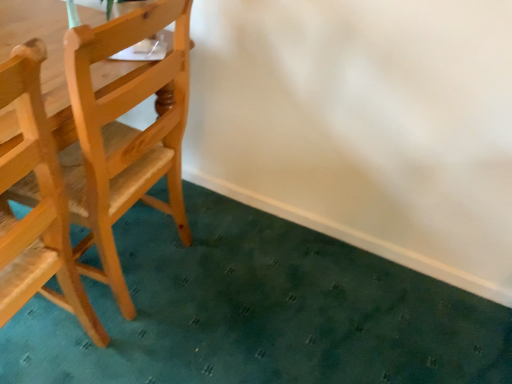
The image size is (512, 384). What do you see at coordinates (37, 204) in the screenshot?
I see `light brown wood chair at left, arranged as the second chair when viewed from the right` at bounding box center [37, 204].

Locate an element on the screen. This screenshot has width=512, height=384. light brown wood chair at left, acting as the 1th chair starting from the left is located at coordinates (37, 204).

Image resolution: width=512 pixels, height=384 pixels. What do you see at coordinates (125, 133) in the screenshot?
I see `natural wood chair at left, acting as the first chair starting from the right` at bounding box center [125, 133].

You are a GUI agent. You are given a task and a screenshot of the screen. Output one action in this format:
    pyautogui.click(x=<x>, y=<y>)
    Task: Click on the natural wood chair at left, acting as the first chair starting from the right
    The height and width of the screenshot is (384, 512).
    Given the screenshot: What is the action you would take?
    pyautogui.click(x=125, y=133)

Locate an element on the screen. The height and width of the screenshot is (384, 512). light brown wood chair at left, arranged as the second chair when viewed from the right is located at coordinates (37, 204).

Between light brown wood chair at left, acting as the 1th chair starting from the left, and natural wood chair at left, the 2th chair viewed from the left, which one appears on the left side from the viewer's perspective?

Positioned to the left is light brown wood chair at left, acting as the 1th chair starting from the left.

Does light brown wood chair at left, acting as the 1th chair starting from the left, come behind natural wood chair at left, acting as the first chair starting from the right?

No, it is in front of natural wood chair at left, acting as the first chair starting from the right.

Between point (21, 48) and point (160, 9), which one is positioned behind?

Positioned behind is point (160, 9).

From the image's perspective, would you say light brown wood chair at left, acting as the 1th chair starting from the left, is positioned over natural wood chair at left, the 2th chair viewed from the left?

Incorrect, from the image's perspective, light brown wood chair at left, acting as the 1th chair starting from the left, is lower than natural wood chair at left, the 2th chair viewed from the left.

From a real-world perspective, is light brown wood chair at left, acting as the 1th chair starting from the left, located higher than natural wood chair at left, the 2th chair viewed from the left?

Actually, light brown wood chair at left, acting as the 1th chair starting from the left, is physically below natural wood chair at left, the 2th chair viewed from the left, in the real world.

Does light brown wood chair at left, arranged as the second chair when viewed from the right, have a lesser width compared to natural wood chair at left, acting as the first chair starting from the right?

Correct, the width of light brown wood chair at left, arranged as the second chair when viewed from the right, is less than that of natural wood chair at left, acting as the first chair starting from the right.

Can you confirm if light brown wood chair at left, acting as the 1th chair starting from the left, is shorter than natural wood chair at left, acting as the first chair starting from the right?

No, light brown wood chair at left, acting as the 1th chair starting from the left, is not shorter than natural wood chair at left, acting as the first chair starting from the right.

Based on the photo, which of these two, light brown wood chair at left, acting as the 1th chair starting from the left, or natural wood chair at left, the 2th chair viewed from the left, is bigger?

Bigger between the two is natural wood chair at left, the 2th chair viewed from the left.

Is light brown wood chair at left, arranged as the second chair when viewed from the right, surrounding natural wood chair at left, acting as the first chair starting from the right?

No, natural wood chair at left, acting as the first chair starting from the right, is not surrounded by light brown wood chair at left, arranged as the second chair when viewed from the right.

Is light brown wood chair at left, acting as the 1th chair starting from the left, positioned far away from natural wood chair at left, acting as the first chair starting from the right?

No, there isn't a large distance between light brown wood chair at left, acting as the 1th chair starting from the left, and natural wood chair at left, acting as the first chair starting from the right.

Could you tell me if light brown wood chair at left, acting as the 1th chair starting from the left, is turned towards natural wood chair at left, the 2th chair viewed from the left?

No, light brown wood chair at left, acting as the 1th chair starting from the left, is not facing towards natural wood chair at left, the 2th chair viewed from the left.

Locate an element on the screen. chair that is above the light brown wood chair at left, acting as the 1th chair starting from the left (from the image's perspective) is located at coordinates (125, 133).

Is natural wood chair at left, the 2th chair viewed from the left, at the left side of light brown wood chair at left, acting as the 1th chair starting from the left?

No.

Is natural wood chair at left, the 2th chair viewed from the left, positioned behind light brown wood chair at left, acting as the 1th chair starting from the left?

Yes, natural wood chair at left, the 2th chair viewed from the left, is behind light brown wood chair at left, acting as the 1th chair starting from the left.

Is point (79, 203) positioned in front of point (36, 129)?

No, it is behind (36, 129).

From the image's perspective, relative to light brown wood chair at left, acting as the 1th chair starting from the left, is natural wood chair at left, acting as the first chair starting from the right, above or below?

Clearly, from the image's perspective, natural wood chair at left, acting as the first chair starting from the right, is above light brown wood chair at left, acting as the 1th chair starting from the left.

From a real-world perspective, is natural wood chair at left, the 2th chair viewed from the left, on top of light brown wood chair at left, acting as the 1th chair starting from the left?

Yes.

In terms of width, does natural wood chair at left, the 2th chair viewed from the left, look wider or thinner when compared to light brown wood chair at left, arranged as the second chair when viewed from the right?

natural wood chair at left, the 2th chair viewed from the left, is wider than light brown wood chair at left, arranged as the second chair when viewed from the right.

Between natural wood chair at left, acting as the first chair starting from the right, and light brown wood chair at left, arranged as the second chair when viewed from the right, which one has less height?

natural wood chair at left, acting as the first chair starting from the right, is shorter.

Is natural wood chair at left, acting as the first chair starting from the right, bigger than light brown wood chair at left, arranged as the second chair when viewed from the right?

Yes.

Can we say natural wood chair at left, the 2th chair viewed from the left, lies outside light brown wood chair at left, acting as the 1th chair starting from the left?

Yes, natural wood chair at left, the 2th chair viewed from the left, is not within light brown wood chair at left, acting as the 1th chair starting from the left.

Is there a large distance between natural wood chair at left, the 2th chair viewed from the left, and light brown wood chair at left, arranged as the second chair when viewed from the right?

No, natural wood chair at left, the 2th chair viewed from the left, is not far from light brown wood chair at left, arranged as the second chair when viewed from the right.

Is natural wood chair at left, acting as the first chair starting from the right, facing away from light brown wood chair at left, acting as the 1th chair starting from the left?

natural wood chair at left, acting as the first chair starting from the right, is not turned away from light brown wood chair at left, acting as the 1th chair starting from the left.

Can you tell me how much natural wood chair at left, the 2th chair viewed from the left, and light brown wood chair at left, acting as the 1th chair starting from the left, differ in facing direction?

The angle between the facing direction of natural wood chair at left, the 2th chair viewed from the left, and the facing direction of light brown wood chair at left, acting as the 1th chair starting from the left, is 6.99 degrees.

You are a GUI agent. You are given a task and a screenshot of the screen. Output one action in this format:
    pyautogui.click(x=<x>, y=<y>)
    Task: Click on the chair lying below the natural wood chair at left, acting as the first chair starting from the right (from the image's perspective)
    The width and height of the screenshot is (512, 384).
    Given the screenshot: What is the action you would take?
    pyautogui.click(x=37, y=204)

Where is `chair that appears below the natural wood chair at left, the 2th chair viewed from the left (from a real-world perspective)`? The height and width of the screenshot is (384, 512). chair that appears below the natural wood chair at left, the 2th chair viewed from the left (from a real-world perspective) is located at coordinates (37, 204).

Image resolution: width=512 pixels, height=384 pixels. I want to click on chair located in front of the natural wood chair at left, the 2th chair viewed from the left, so click(x=37, y=204).